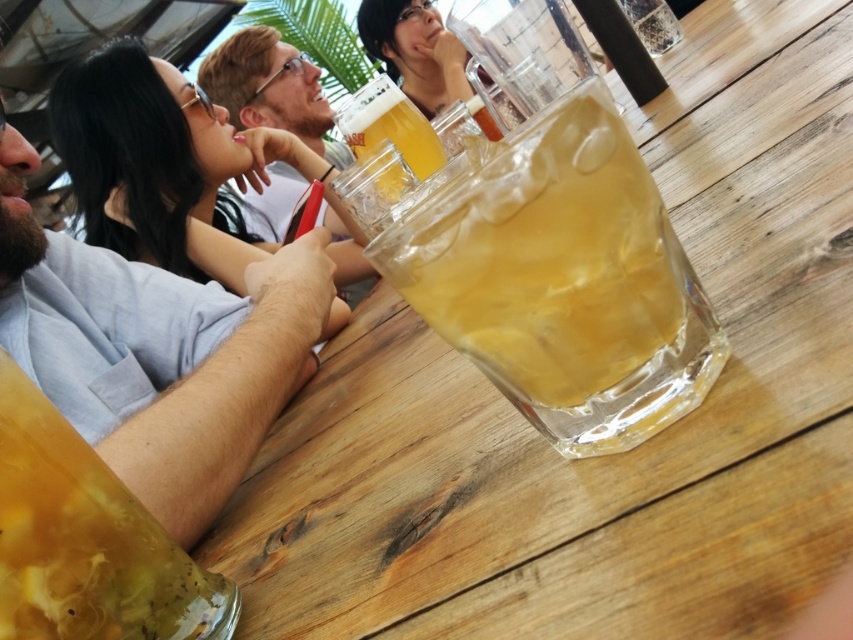
Question: Which point appears closest to the camera in this image?

Choices:
 (A) (587, 296)
 (B) (245, 88)
 (C) (427, 136)

Answer: (A)

Question: Is matte white shirt at upper center behind translucent glass mug at center?

Choices:
 (A) no
 (B) yes

Answer: (B)

Question: Is translucent yellow liquid at lower left below translucent glass mug at center?

Choices:
 (A) no
 (B) yes

Answer: (B)

Question: Is translucent yellow liquid at lower left above matte white shirt at upper center?

Choices:
 (A) no
 (B) yes

Answer: (A)

Question: Which of these objects is positioned farthest from the translucent yellow liquid at lower left?

Choices:
 (A) matte white shirt at upper center
 (B) translucent glass at center
 (C) translucent glass mug at center

Answer: (A)

Question: Among these points, which one is nearest to the camera?

Choices:
 (A) (259, 58)
 (B) (61, 432)
 (C) (469, 221)

Answer: (C)